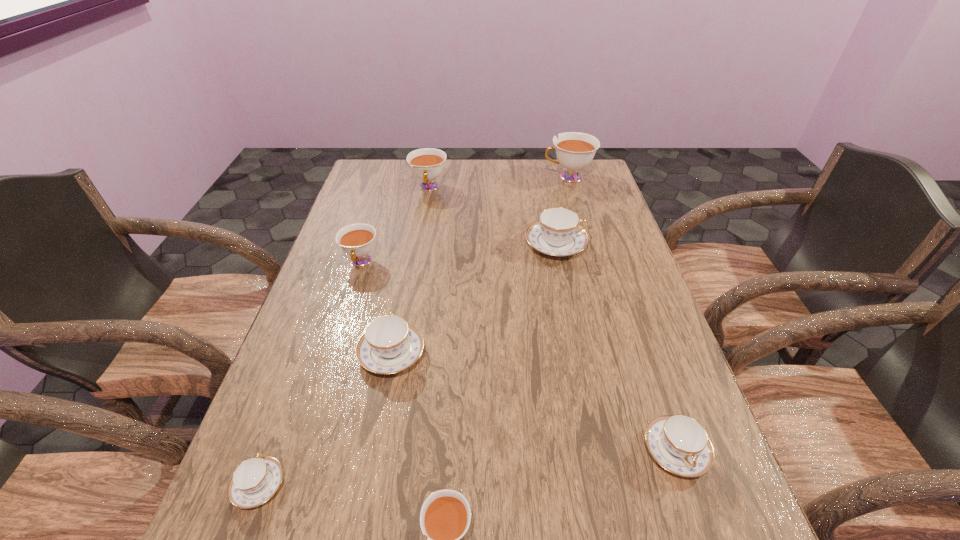
Find the location of `free spot located on the side with the handle of the third smallest blue teacup`. free spot located on the side with the handle of the third smallest blue teacup is located at coordinates (403, 293).

The image size is (960, 540). Identify the location of blank space located 0.300m on the side with the handle of the leftmost blue teacup. (314, 335).

You are a GUI agent. You are given a task and a screenshot of the screen. Output one action in this format:
    pyautogui.click(x=<x>, y=<y>)
    Task: Click on the vacant area situated on the side with the handle of the leftmost blue teacup
    This screenshot has height=540, width=960.
    Given the screenshot: What is the action you would take?
    tap(277, 435)

Image resolution: width=960 pixels, height=540 pixels. I want to click on free space located 0.100m on the side with the handle of the leftmost blue teacup, so tap(285, 411).

Identify the location of object present at the far right corner. This screenshot has width=960, height=540. (574, 150).

In the image, there is a desktop. Where is `vacant space at the far edge`? This screenshot has width=960, height=540. vacant space at the far edge is located at coordinates click(x=509, y=160).

The width and height of the screenshot is (960, 540). In the image, there is a desktop. What are the coordinates of `vacant area at the right edge` in the screenshot? It's located at (650, 402).

In the image, there is a desktop. Identify the location of vacant space at the far left corner. The image size is (960, 540). (363, 179).

Identify the location of vacant space at the far right corner. The width and height of the screenshot is (960, 540). (564, 192).

Find the location of a particular element. empty location between the third biggest blue teacup and the shortest teacup is located at coordinates (468, 468).